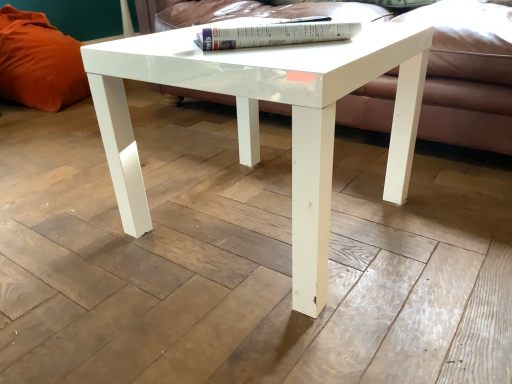
Locate an element on the screen. This screenshot has height=384, width=512. free point below white glossy coffee table at center (from a real-world perspective) is located at coordinates (252, 217).